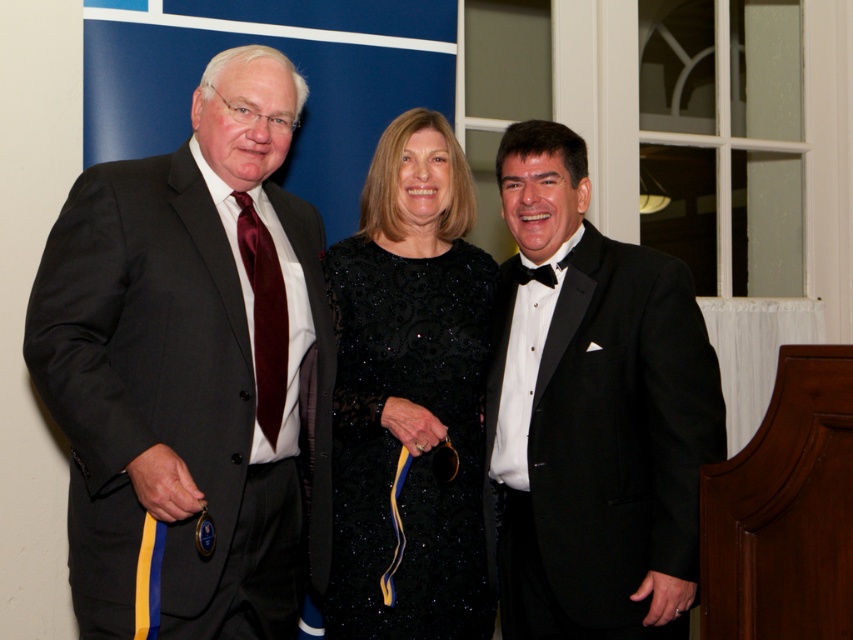
Can you confirm if black satin tuxedo at right is shorter than black sequined dress at center?

In fact, black satin tuxedo at right may be taller than black sequined dress at center.

Is point (572, 147) in front of point (432, 579)?

No.

Is point (613, 288) positioned behind point (368, 563)?

Yes, point (613, 288) is farther from viewer.

The width and height of the screenshot is (853, 640). Identify the location of black satin tuxedo at right. (590, 412).

The image size is (853, 640). What do you see at coordinates (192, 371) in the screenshot? I see `matte black suit at left` at bounding box center [192, 371].

In the scene shown: Does matte black suit at left appear on the left side of black sequined dress at center?

Yes, matte black suit at left is to the left of black sequined dress at center.

Describe the element at coordinates (192, 371) in the screenshot. I see `matte black suit at left` at that location.

Image resolution: width=853 pixels, height=640 pixels. What are the coordinates of `matte black suit at left` in the screenshot? It's located at (192, 371).

Which of these two, matte black suit at left or black satin tuxedo at right, stands shorter?

With less height is black satin tuxedo at right.

Can you confirm if matte black suit at left is wider than black satin tuxedo at right?

Correct, the width of matte black suit at left exceeds that of black satin tuxedo at right.

This screenshot has width=853, height=640. In order to click on matte black suit at left in this screenshot , I will do `click(192, 371)`.